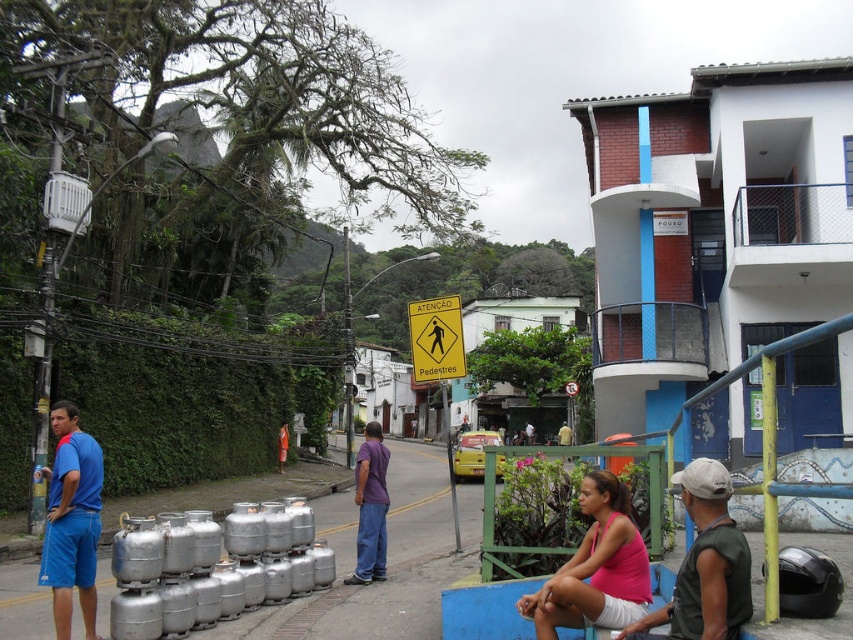
You are standing at the center of the street and want to locate the green sleeveless shirt at lower right. Based on the scene, where would you look relative to the propane tanks stacked along the sidewalk?

The green sleeveless shirt at lower right is located at point (705, 564), which is to the right and slightly above the propane tanks stacked along the sidewalk.

You are a fashion designer analyzing the outfits in the scene. Which of the two items, the pink fabric tank top at lower center or the purple matte shirt at center, would you recommend for someone wanting a shorter sleeve length?

The pink fabric tank top at lower center has shorter sleeves than the purple matte shirt at center, so it would be the better recommendation for someone seeking a shorter sleeve length.

You are standing at the camera position and want to pick up the pink fabric tank top at lower center. Can you reach it without moving from your current position?

The pink fabric tank top at lower center is 4.37 meters away from the camera, so you cannot reach it without moving from your current position.